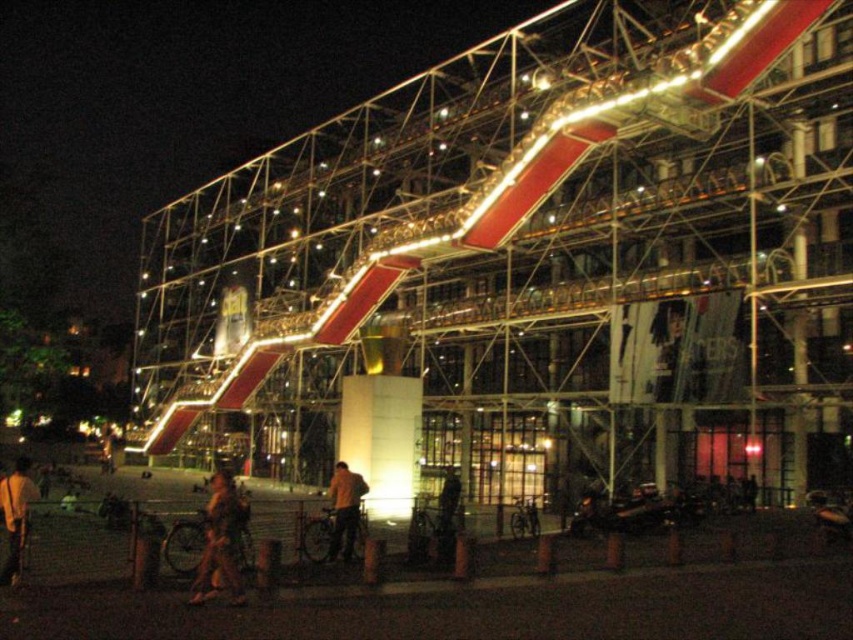
Question: Which point appears closest to the camera in this image?

Choices:
 (A) (332, 474)
 (B) (230, 524)

Answer: (B)

Question: Among these points, which one is nearest to the camera?

Choices:
 (A) (225, 548)
 (B) (334, 488)

Answer: (A)

Question: Observing the image, what is the correct spatial positioning of camouflage fabric jacket at lower center in reference to yellow fabric jacket at center?

Choices:
 (A) below
 (B) above

Answer: (A)

Question: Which object is farther from the camera taking this photo?

Choices:
 (A) yellow fabric jacket at center
 (B) camouflage fabric jacket at lower center

Answer: (A)

Question: Is camouflage fabric jacket at lower center to the right of yellow fabric jacket at center from the viewer's perspective?

Choices:
 (A) no
 (B) yes

Answer: (A)

Question: From the image, what is the correct spatial relationship of camouflage fabric jacket at lower center in relation to yellow fabric jacket at center?

Choices:
 (A) left
 (B) right

Answer: (A)